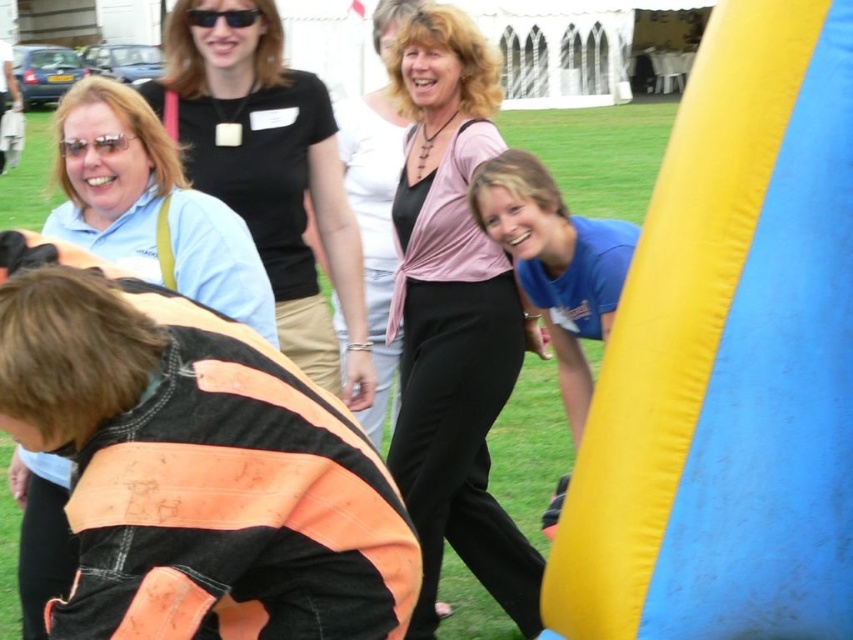
In the scene shown: You are organizing a clothing donation drive and need to categorize shirts based on their size. You have two shirts to sort out. The light blue shirt at upper left and the blue cotton shirt at lower right. Which shirt should you place in the larger size bin?

The light blue shirt at upper left should be placed in the larger size bin because its width is larger than the blue cotton shirt at lower right.

You are organizing a photo shoot and need to arrange two models wearing the pink fabric top at center and the blue cotton shirt at lower right. Based on their clothing lengths, which model should stand in front to ensure their outfits are fully visible?

The pink fabric top at center is shorter than the blue cotton shirt at lower right, so the model wearing the pink fabric top at center should stand in front to ensure their shorter top doesn not get covered by the longer blue cotton shirt.